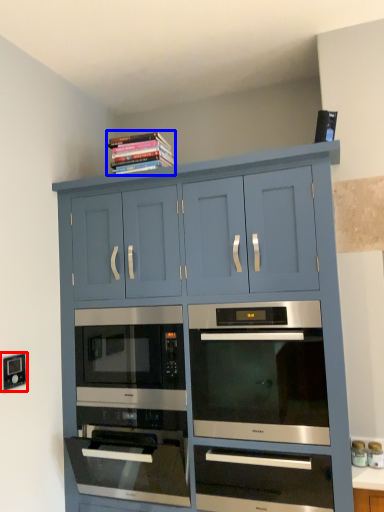
Question: Which point is closer to the camera, electric outlet (highlighted by a red box) or book (highlighted by a blue box)?

Choices:
 (A) electric outlet
 (B) book

Answer: (A)